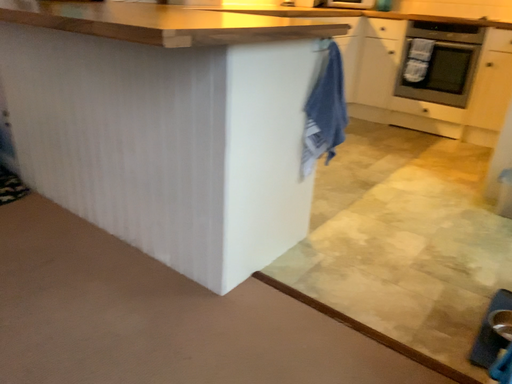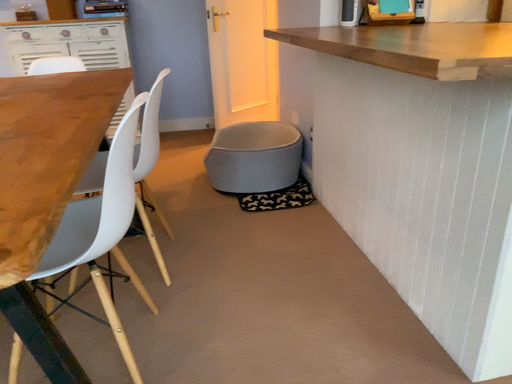
Question: Which way did the camera rotate in the video?

Choices:
 (A) rotated upward
 (B) rotated downward

Answer: (A)